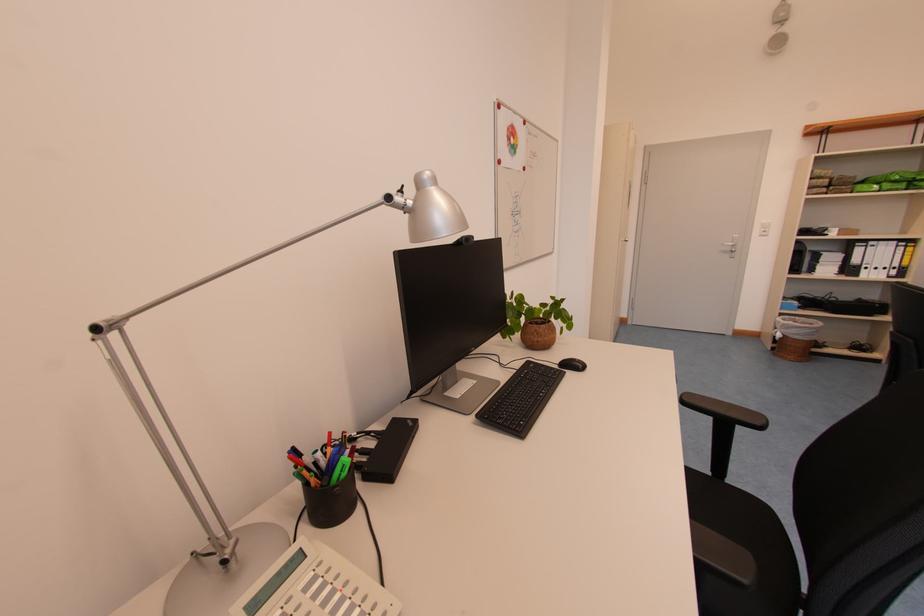
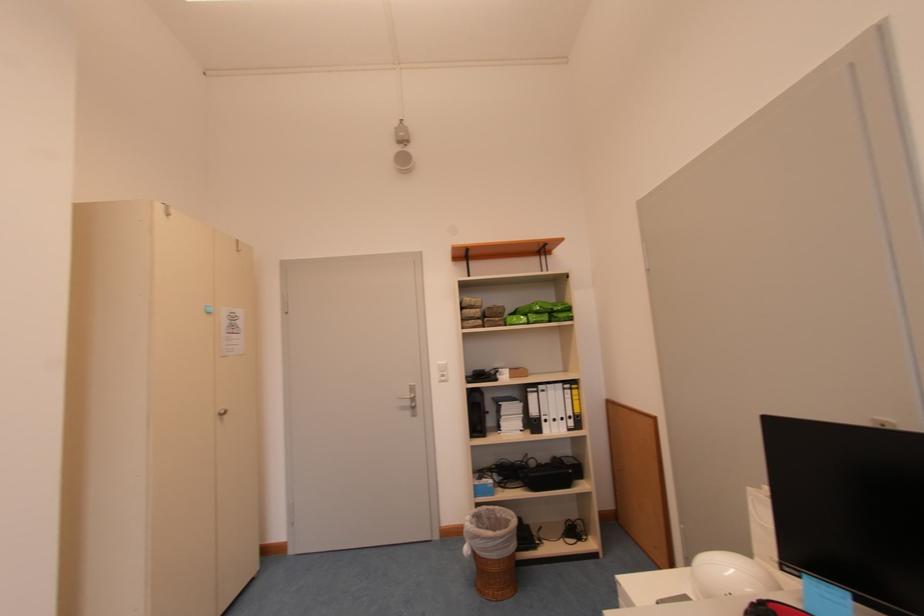
Find the pixel in the second image that matches (736,252) in the first image.

(415, 406)